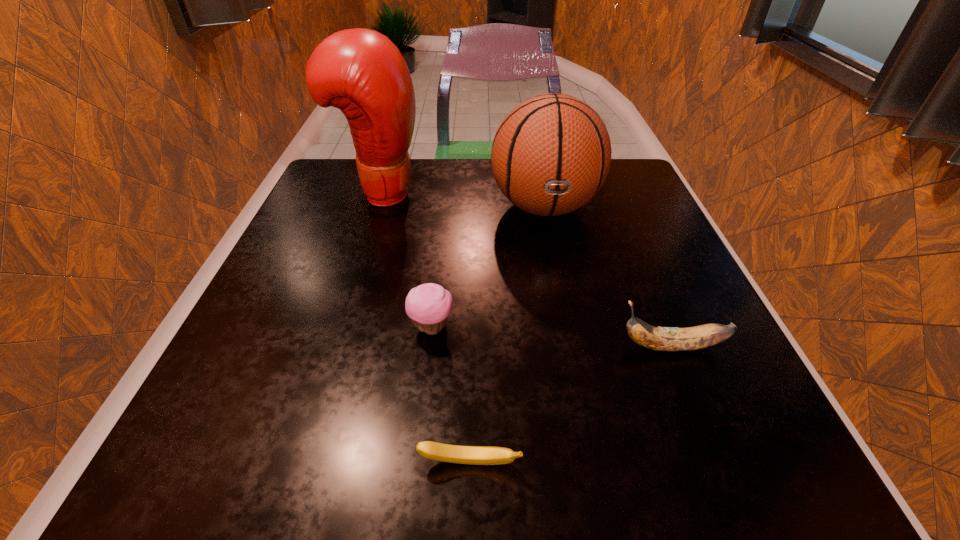
Find the location of `vacant space that satisfies the following two spatial constraints: 1. on the striking surface of the tallest object; 2. on the left side of the cupcake`. vacant space that satisfies the following two spatial constraints: 1. on the striking surface of the tallest object; 2. on the left side of the cupcake is located at coordinates tap(338, 327).

Locate an element on the screen. This screenshot has width=960, height=540. free point that satisfies the following two spatial constraints: 1. at the stem of the right banana; 2. at the stem of the left banana is located at coordinates (719, 463).

Find the location of a particular element. This screenshot has height=540, width=960. vacant position in the image that satisfies the following two spatial constraints: 1. on the back side of the cupcake; 2. on the striking surface of the tallest object is located at coordinates (446, 192).